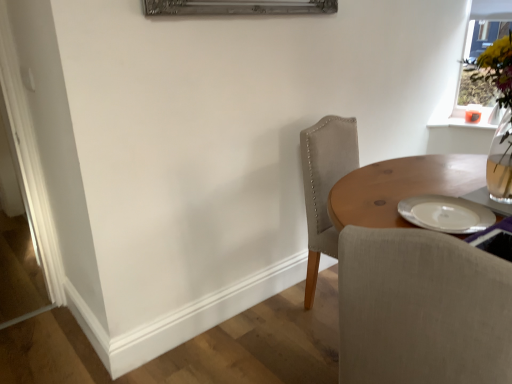
Question: Should I look upward or downward to see light gray fabric chair at center?

Choices:
 (A) down
 (B) up

Answer: (A)

Question: Does light gray fabric chair at center have a larger size compared to transparent glass vase at upper right?

Choices:
 (A) yes
 (B) no

Answer: (A)

Question: Does light gray fabric chair at center have a lesser width compared to transparent glass vase at upper right?

Choices:
 (A) yes
 (B) no

Answer: (B)

Question: From the image's perspective, does light gray fabric chair at center appear lower than transparent glass vase at upper right?

Choices:
 (A) no
 (B) yes

Answer: (B)

Question: Does light gray fabric chair at center come in front of transparent glass vase at upper right?

Choices:
 (A) yes
 (B) no

Answer: (A)

Question: From a real-world perspective, is light gray fabric chair at center located beneath transparent glass vase at upper right?

Choices:
 (A) yes
 (B) no

Answer: (A)

Question: From a real-world perspective, does light gray fabric chair at center stand above transparent glass vase at upper right?

Choices:
 (A) no
 (B) yes

Answer: (A)

Question: Can light gray fabric chair at center be found inside transparent glass vase at upper right?

Choices:
 (A) yes
 (B) no

Answer: (B)

Question: Can you confirm if transparent glass vase at upper right is smaller than light gray fabric chair at center?

Choices:
 (A) no
 (B) yes

Answer: (B)

Question: Is transparent glass vase at upper right facing towards light gray fabric chair at center?

Choices:
 (A) no
 (B) yes

Answer: (B)

Question: From the image's perspective, is transparent glass vase at upper right on top of light gray fabric chair at center?

Choices:
 (A) yes
 (B) no

Answer: (A)

Question: From the image's perspective, is transparent glass vase at upper right located beneath light gray fabric chair at center?

Choices:
 (A) yes
 (B) no

Answer: (B)

Question: Can you confirm if transparent glass vase at upper right is positioned to the right of light gray fabric chair at center?

Choices:
 (A) no
 (B) yes

Answer: (B)

Question: Would you say light gray fabric chair at center is inside or outside transparent glass vase at upper right?

Choices:
 (A) outside
 (B) inside

Answer: (A)